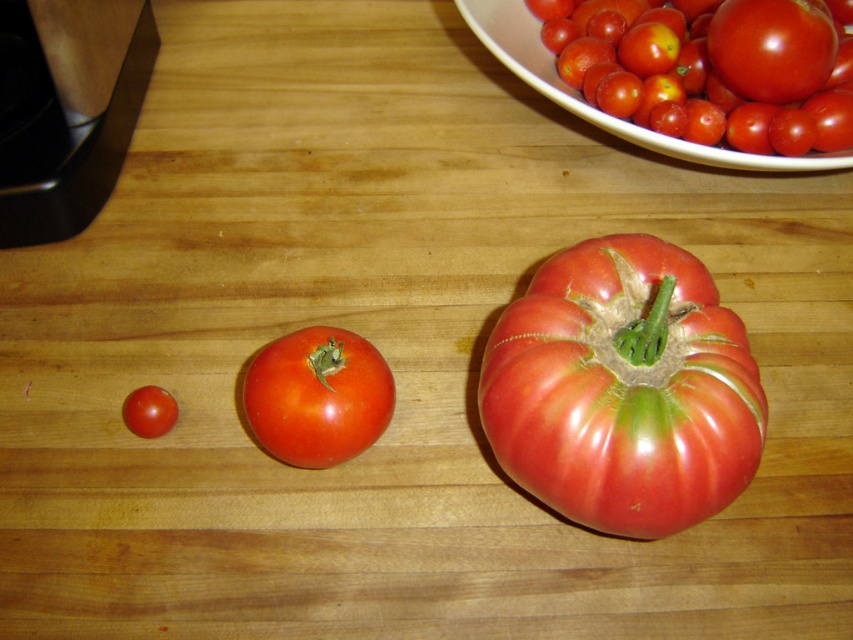
Question: Which object is the closest to the glossy ceramic bowl at upper right?

Choices:
 (A) glossy red tomato at lower left
 (B) shiny red tomato at center

Answer: (B)

Question: Which point is closer to the camera taking this photo?

Choices:
 (A) (253, 388)
 (B) (625, 412)

Answer: (B)

Question: From the image, what is the correct spatial relationship of shiny red tomato at center in relation to glossy red tomato at lower left?

Choices:
 (A) left
 (B) right

Answer: (B)

Question: Is red matte tomato at center to the right of shiny red tomato at center from the viewer's perspective?

Choices:
 (A) no
 (B) yes

Answer: (B)

Question: Considering the relative positions of red matte tomato at center and glossy red tomato at lower left in the image provided, where is red matte tomato at center located with respect to glossy red tomato at lower left?

Choices:
 (A) below
 (B) above

Answer: (B)

Question: Considering the real-world distances, which object is farthest from the shiny red tomato at center?

Choices:
 (A) glossy ceramic bowl at upper right
 (B) red matte tomato at center
 (C) glossy red tomato at lower left
 (D) glossy red tomato at upper right

Answer: (D)